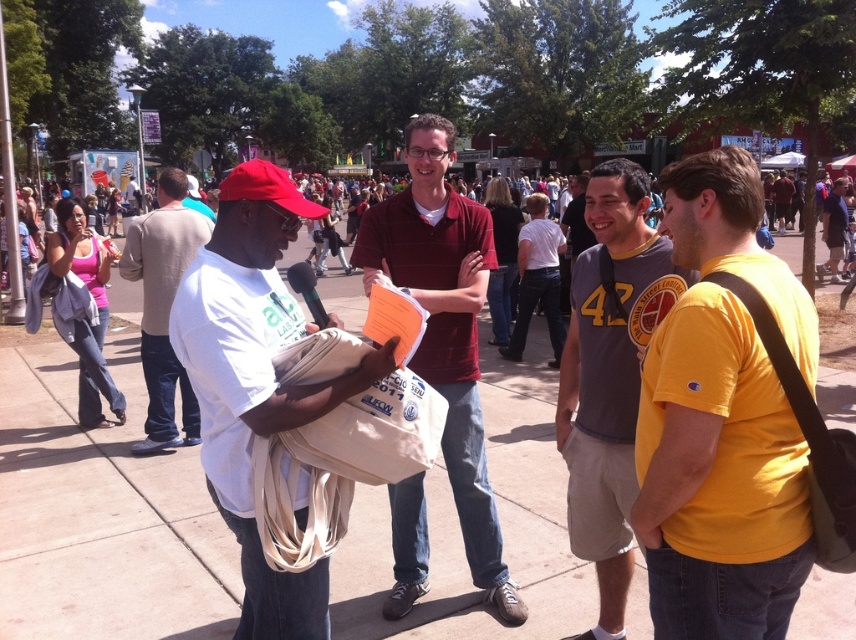
You are organizing a clothing donation drive and need to determine which items can fit into a standard donation box. The yellow jersey at center and the white cotton shirt at center are both candidates. Based on their sizes, which one is more likely to fit into the box without folding?

The yellow jersey at center is more likely to fit into the donation box without folding since its width is less than that of the white cotton shirt at center.

You are at a sports event and see two participants wearing a maroon striped shirt at center and a yellow jersey at center. Which one is positioned higher in the image?

The maroon striped shirt at center is positioned higher than the yellow jersey at center in the image.